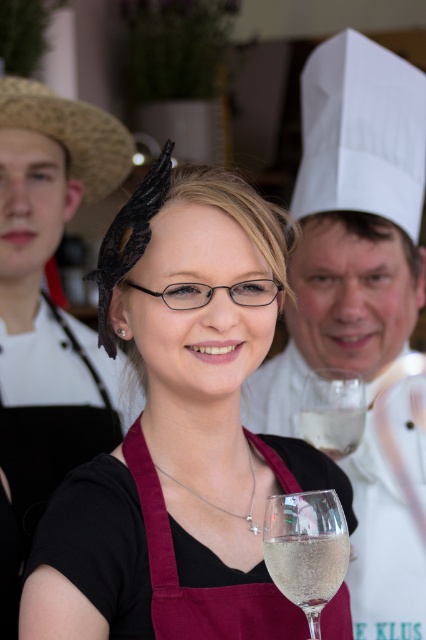
Between matte black hair clip at center and clear glass wine glass at center, which one is positioned higher?

matte black hair clip at center is higher up.

At what (x,y) coordinates should I click in order to perform the action: click on matte black hair clip at center. Please return your answer as a coordinate pair (x, y). Looking at the image, I should click on (175, 429).

What do you see at coordinates (175, 429) in the screenshot?
I see `matte black hair clip at center` at bounding box center [175, 429].

Where is `matte black hair clip at center`? The width and height of the screenshot is (426, 640). matte black hair clip at center is located at coordinates (175, 429).

Between matte black hair clip at center and white chef hat at upper center, which one has less height?

Standing shorter between the two is matte black hair clip at center.

Is matte black hair clip at center positioned at the back of white chef hat at upper center?

No, it is not.

Is point (181, 314) behind point (350, 467)?

No, it is not.

Where is `matte black hair clip at center`? The height and width of the screenshot is (640, 426). matte black hair clip at center is located at coordinates (175, 429).

The height and width of the screenshot is (640, 426). Describe the element at coordinates (175, 429) in the screenshot. I see `matte black hair clip at center` at that location.

Is point (256, 500) behind point (189, 554)?

Yes, point (256, 500) is farther from viewer.

Is point (241, 577) less distant than point (129, 468)?

Yes, point (241, 577) is in front of point (129, 468).

Where is `matte black hair clip at center`? The width and height of the screenshot is (426, 640). matte black hair clip at center is located at coordinates (175, 429).